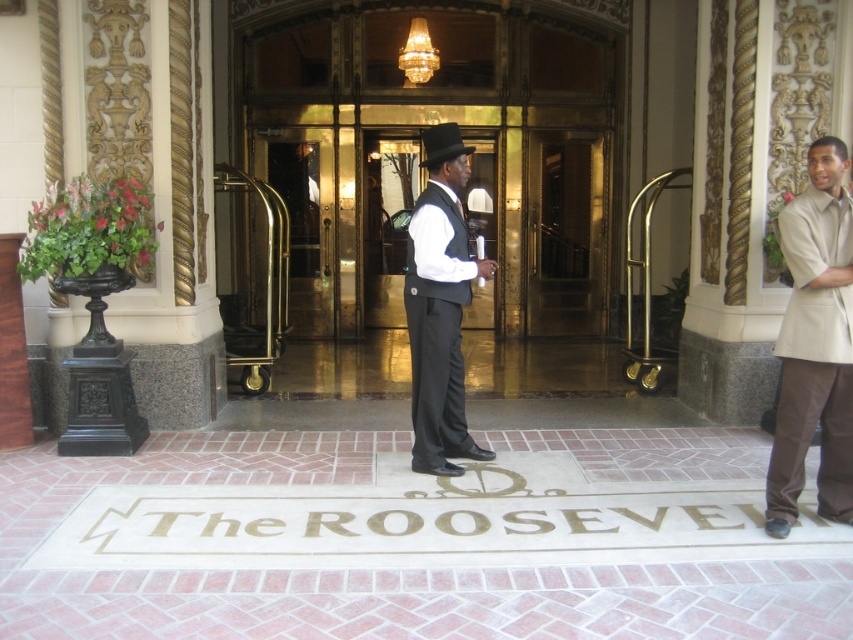
Question: Observing the image, what is the correct spatial positioning of beige fabric coat at right in reference to matte black suit at center?

Choices:
 (A) below
 (B) above

Answer: (A)

Question: Among these objects, which one is nearest to the camera?

Choices:
 (A) black felt fedora at center
 (B) beige fabric coat at right

Answer: (B)

Question: Among these points, which one is nearest to the camera?

Choices:
 (A) (463, 150)
 (B) (833, 180)

Answer: (B)

Question: Among these objects, which one is farthest from the camera?

Choices:
 (A) black felt fedora at center
 (B) beige fabric coat at right
 (C) shiny gold door at center

Answer: (C)

Question: Does shiny gold door at center have a smaller size compared to black felt fedora at center?

Choices:
 (A) yes
 (B) no

Answer: (B)

Question: Is beige fabric coat at right to the right of matte black suit at center from the viewer's perspective?

Choices:
 (A) no
 (B) yes

Answer: (B)